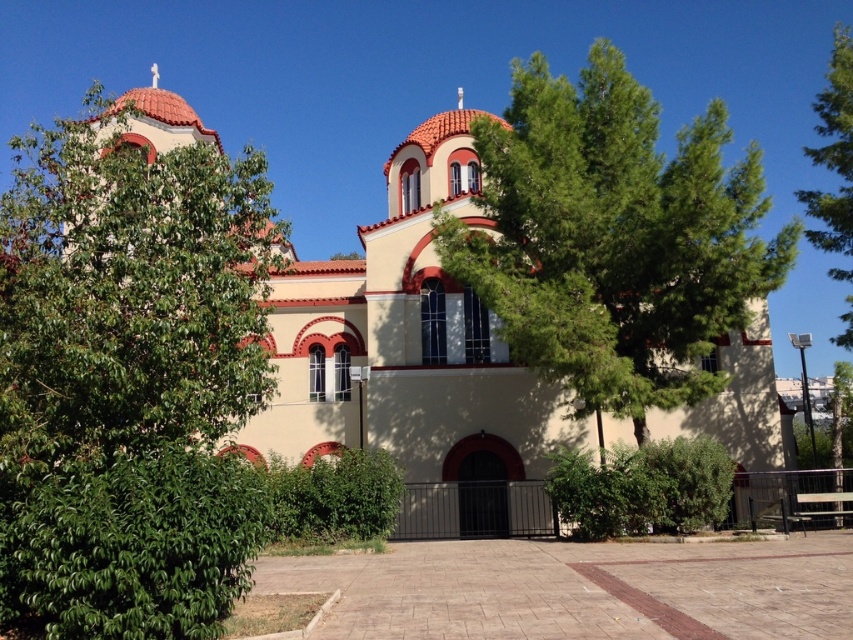
Does point (625, 324) come closer to viewer compared to point (831, 88)?

That is True.

Between green leafy tree at center and green leafy tree at upper right, which one is positioned higher?

green leafy tree at upper right

Does point (515, 264) come closer to viewer compared to point (817, 241)?

Yes, point (515, 264) is closer to viewer.

Find the location of a particular element. The height and width of the screenshot is (640, 853). green leafy tree at center is located at coordinates (613, 237).

Can you confirm if beige stucco church at center is thinner than green leafy tree at center?

Incorrect, beige stucco church at center's width is not less than green leafy tree at center's.

Is beige stucco church at center smaller than green leafy tree at center?

Incorrect, beige stucco church at center is not smaller in size than green leafy tree at center.

Identify the location of beige stucco church at center. The width and height of the screenshot is (853, 640). (412, 356).

Does green leafy tree at left appear on the right side of green leafy tree at center?

No, green leafy tree at left is not to the right of green leafy tree at center.

This screenshot has height=640, width=853. In order to click on green leafy tree at left in this screenshot , I will do `click(126, 376)`.